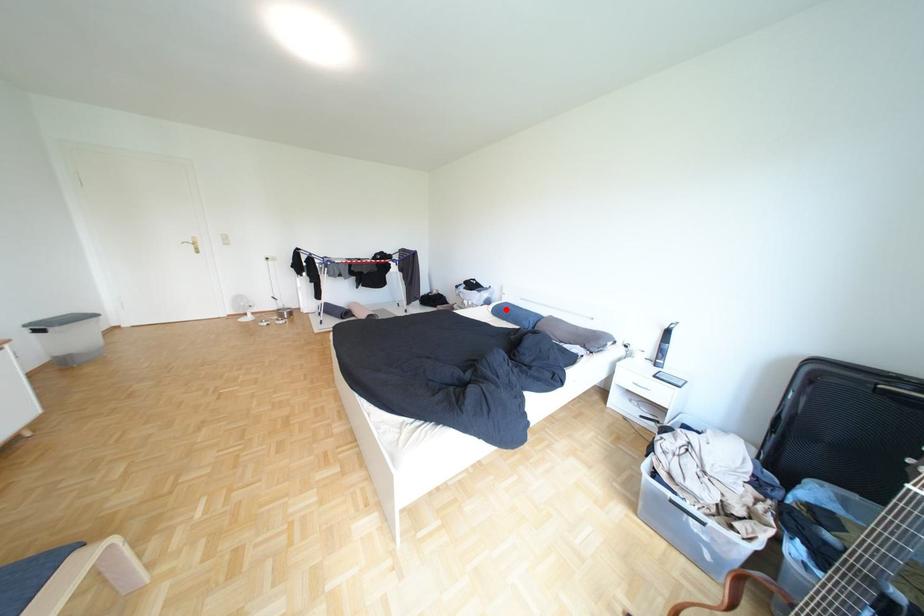
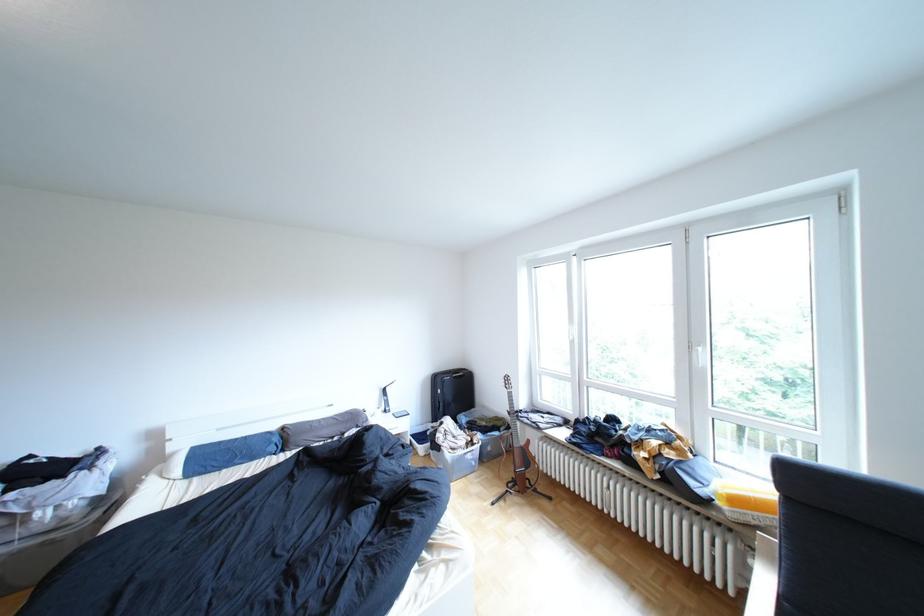
Question: I am providing you with two images of the same scene from different viewpoints. A red point is shown in image1. For the corresponding object point in image2, is it positioned nearer or farther from the camera?

Choices:
 (A) Nearer
 (B) Farther

Answer: (A)